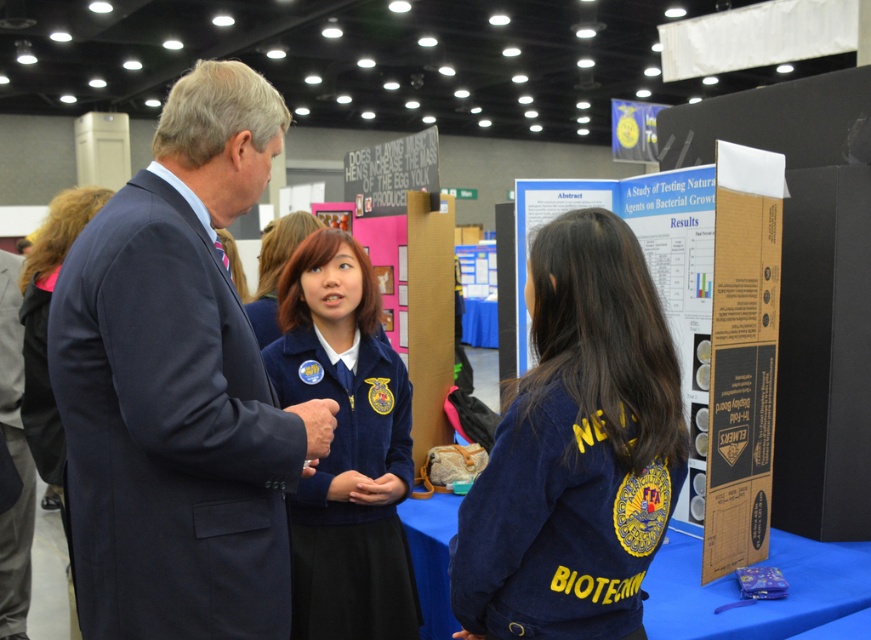
In the scene shown: You are a photographer at the event and want to take a group photo of the navy blue jacket at center and dark blue uniform at center. To ensure both are in frame, should you position the camera to the left or right of the two?

Since the navy blue jacket at center is to the right of the dark blue uniform at center, you should position the camera to the left of the two to ensure both are in frame.

You are a photographer at the event and need to capture a group photo of the blue velvety jacket at center and the matte blue uniform at center. Which of the two should you position closer to the camera to ensure both are in focus without adjusting the camera settings?

The blue velvety jacket at center is bigger than the matte blue uniform at center, so you should position the matte blue uniform at center closer to the camera to ensure both are in focus.

You are standing at the point labeled as point (322, 230) in the image. A visitor asks you how far you are from them. What do you tell them?

The point (322, 230) and viewer are 2.31 meters apart, so I am 2.31 meters away from them.